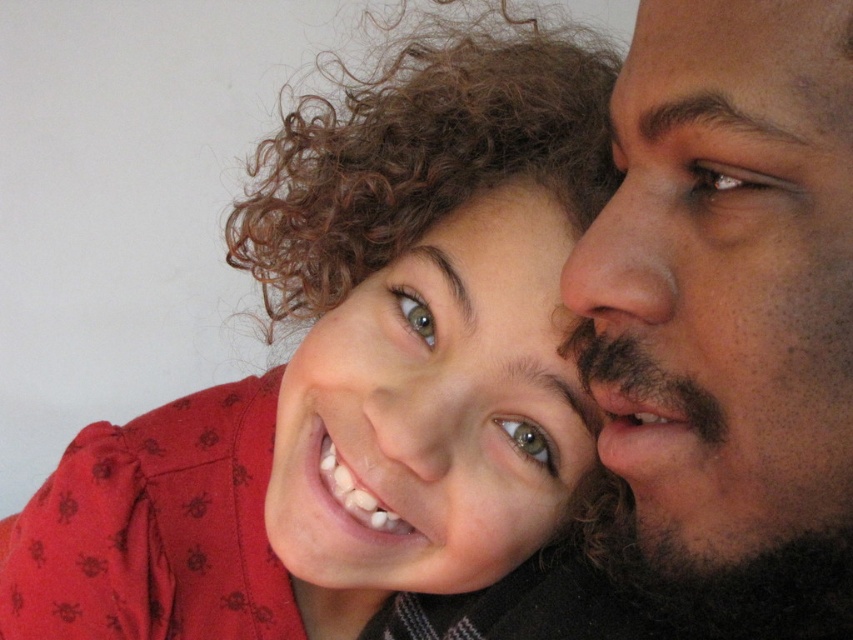
Does matte red shirt at center have a greater height compared to dark skin face at right?

Yes, matte red shirt at center is taller than dark skin face at right.

Does point (312, 188) come behind point (717, 193)?

Yes, it is behind point (717, 193).

At what (x,y) coordinates should I click in order to perform the action: click on matte red shirt at center. Please return your answer as a coordinate pair (x, y). Looking at the image, I should click on (357, 374).

Which is above, dark skin face at right or smooth skin face at center?

dark skin face at right is higher up.

Is dark skin face at right shorter than smooth skin face at center?

Correct, dark skin face at right is not as tall as smooth skin face at center.

Which is in front, point (683, 348) or point (351, 436)?

Point (683, 348) is more forward.

Locate an element on the screen. dark skin face at right is located at coordinates (726, 278).

Between matte red shirt at center and smooth skin face at center, which one has less height?

With less height is smooth skin face at center.

The width and height of the screenshot is (853, 640). Describe the element at coordinates (357, 374) in the screenshot. I see `matte red shirt at center` at that location.

Who is more distant from viewer, (416, 232) or (436, 504)?

The point (416, 232) is behind.

At what (x,y) coordinates should I click in order to perform the action: click on matte red shirt at center. Please return your answer as a coordinate pair (x, y). This screenshot has height=640, width=853. Looking at the image, I should click on (357, 374).